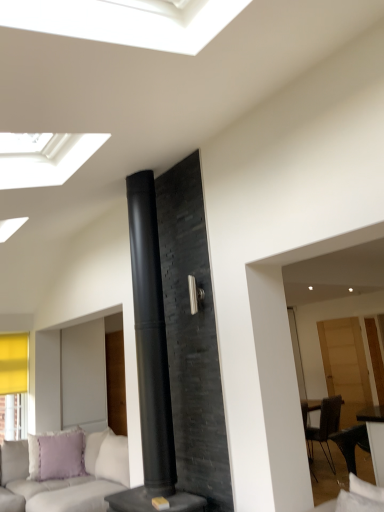
Question: Can you see translucent wood door at right touching lavender fabric pillow at lower left?

Choices:
 (A) yes
 (B) no

Answer: (B)

Question: Does translucent wood door at right have a greater width compared to lavender fabric pillow at lower left?

Choices:
 (A) yes
 (B) no

Answer: (B)

Question: Does translucent wood door at right have a larger size compared to lavender fabric pillow at lower left?

Choices:
 (A) yes
 (B) no

Answer: (A)

Question: Considering the relative sizes of translucent wood door at right and lavender fabric pillow at lower left in the image provided, is translucent wood door at right smaller than lavender fabric pillow at lower left?

Choices:
 (A) no
 (B) yes

Answer: (A)

Question: Are translucent wood door at right and lavender fabric pillow at lower left located far from each other?

Choices:
 (A) yes
 (B) no

Answer: (A)

Question: In terms of size, does light gray fabric couch at lower left appear bigger or smaller than translucent wood door at right?

Choices:
 (A) big
 (B) small

Answer: (A)

Question: From their relative heights in the image, would you say light gray fabric couch at lower left is taller or shorter than translucent wood door at right?

Choices:
 (A) tall
 (B) short

Answer: (B)

Question: Is light gray fabric couch at lower left situated inside translucent wood door at right or outside?

Choices:
 (A) inside
 (B) outside

Answer: (B)

Question: From a real-world perspective, relative to translucent wood door at right, is light gray fabric couch at lower left vertically above or below?

Choices:
 (A) below
 (B) above

Answer: (A)

Question: Is lavender fabric pillow at lower left bigger or smaller than black matte fireplace at center?

Choices:
 (A) small
 (B) big

Answer: (A)

Question: Is lavender fabric pillow at lower left wider or thinner than black matte fireplace at center?

Choices:
 (A) thin
 (B) wide

Answer: (A)

Question: Is lavender fabric pillow at lower left taller or shorter than black matte fireplace at center?

Choices:
 (A) short
 (B) tall

Answer: (A)

Question: Is lavender fabric pillow at lower left situated inside black matte fireplace at center or outside?

Choices:
 (A) outside
 (B) inside

Answer: (A)

Question: Is light gray fabric couch at lower left spatially inside lavender fabric pillow at lower left, or outside of it?

Choices:
 (A) inside
 (B) outside

Answer: (B)

Question: From the image's perspective, is light gray fabric couch at lower left positioned above or below lavender fabric pillow at lower left?

Choices:
 (A) above
 (B) below

Answer: (B)